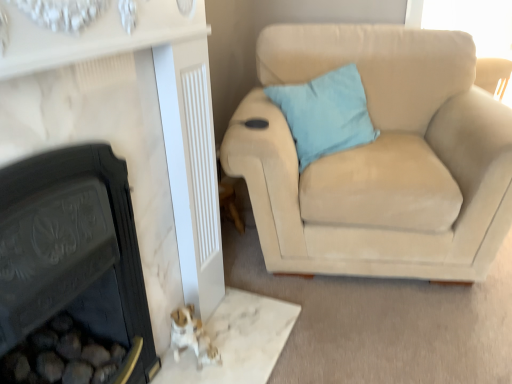
Question: In the image, is black cast iron fireplace at lower left, which is the 1th fireplace in left-to-right order, on the left side or the right side of suede beige couch at right?

Choices:
 (A) right
 (B) left

Answer: (B)

Question: Would you say black cast iron fireplace at lower left, the second fireplace positioned from the right, is inside or outside suede beige couch at right?

Choices:
 (A) outside
 (B) inside

Answer: (A)

Question: Estimate the real-world distances between objects in this image. Which object is farther from the matte black fireplace at lower left, positioned as the first fireplace in right-to-left order?

Choices:
 (A) suede beige couch at right
 (B) black cast iron fireplace at lower left, which is the 1th fireplace in left-to-right order
 (C) light blue fabric pillow at upper right

Answer: (C)

Question: Estimate the real-world distances between objects in this image. Which object is farther from the matte black fireplace at lower left, the second fireplace in the left-to-right sequence?

Choices:
 (A) light blue fabric pillow at upper right
 (B) black cast iron fireplace at lower left, the second fireplace positioned from the right
 (C) suede beige couch at right

Answer: (A)